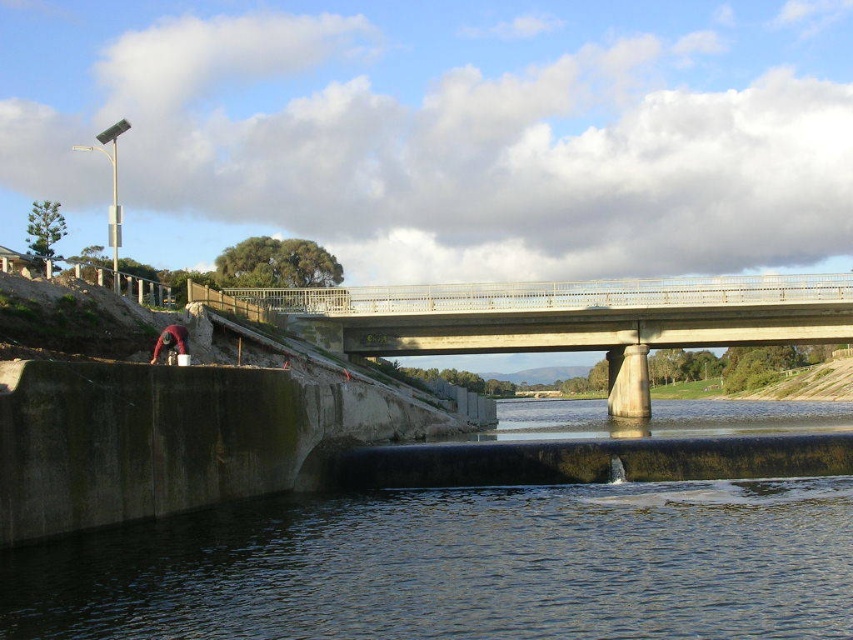
You are a maintenance worker on the concrete bridge at center. You need to check the water level below. Where is the dark blue water at lower center located in relation to your position?

The dark blue water at lower center is positioned under the concrete bridge at center, so it is directly below your current position on the bridge.

You are standing at the riverside and want to reach both points marked on the image. Which point, point (554, 500) or point (413, 312), will you reach first as you move towards them?

Point (554, 500) is closer to the viewer than point (413, 312), so you will reach point (554, 500) first.

You are a construction worker assessing the riverside scene. You need to determine if the dark blue water at lower center can fully submerge the concrete bridge at center. Based on the scene description, what is your conclusion?

The dark blue water at lower center has a smaller size compared to concrete bridge at center, so it cannot fully submerge the concrete bridge at center.